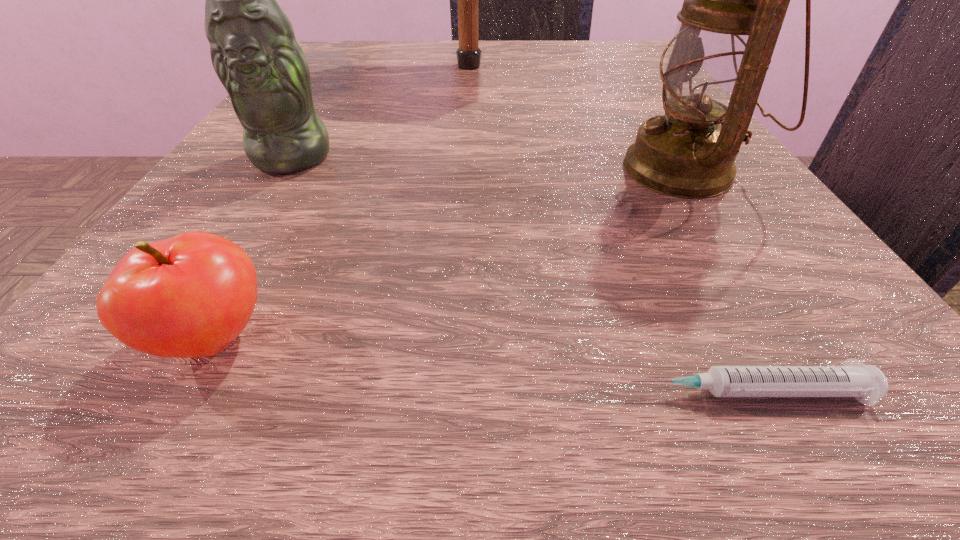
Where is `vacant space that satisfies the following two spatial constraints: 1. on the back side of the oil lamp; 2. on the striking surface of the mallet`? This screenshot has width=960, height=540. vacant space that satisfies the following two spatial constraints: 1. on the back side of the oil lamp; 2. on the striking surface of the mallet is located at coordinates (617, 66).

You are a GUI agent. You are given a task and a screenshot of the screen. Output one action in this format:
    pyautogui.click(x=<x>, y=<y>)
    Task: Click on the vacant space that satisfies the following two spatial constraints: 1. on the front side of the oil lamp; 2. at the needle end of the syringe
    This screenshot has width=960, height=540.
    Given the screenshot: What is the action you would take?
    pyautogui.click(x=825, y=392)